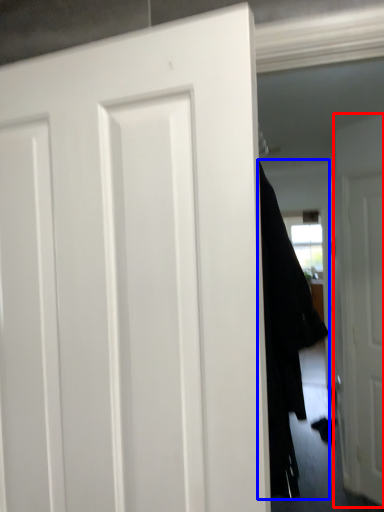
Question: Which of the following is the closest to the observer, door (highlighted by a red box) or garment (highlighted by a blue box)?

Choices:
 (A) door
 (B) garment

Answer: (B)